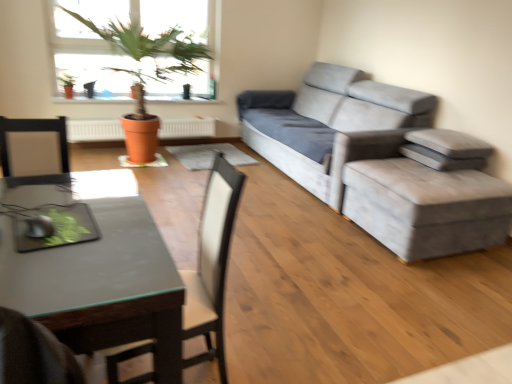
You are a GUI agent. You are given a task and a screenshot of the screen. Output one action in this format:
    pyautogui.click(x=<x>, y=<y>)
    Task: Click on the vacant area that lies between velvet grey stool at right and black leather swivel chair at center
    The image size is (512, 384).
    Given the screenshot: What is the action you would take?
    pyautogui.click(x=337, y=283)